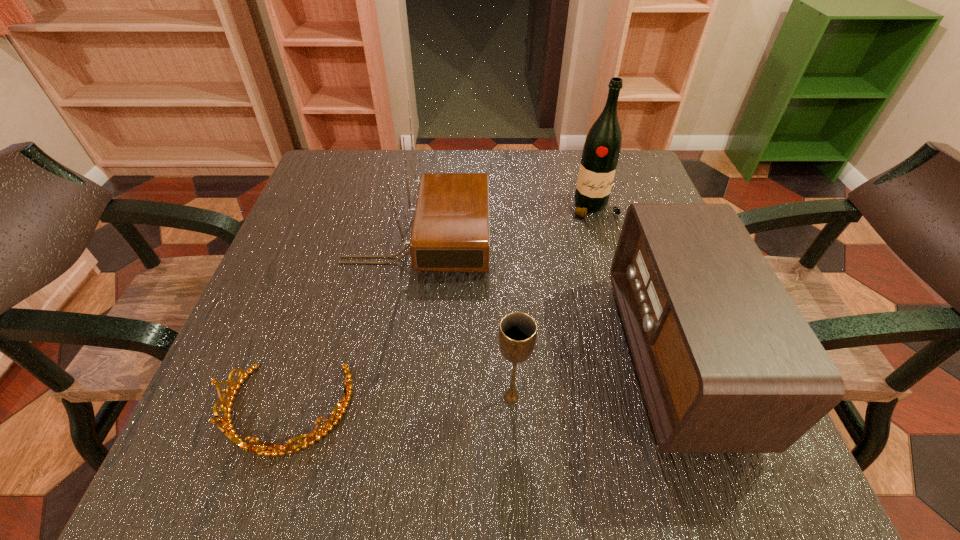
Image resolution: width=960 pixels, height=540 pixels. Find the location of `free region located 0.200m on the front-facing side of the shorter radio receiver`. free region located 0.200m on the front-facing side of the shorter radio receiver is located at coordinates (509, 356).

I want to click on vacant space located 0.070m on the right of the third object from left to right, so click(572, 397).

Identify the location of wine bottle situated at the far edge. (x=601, y=151).

Where is `radio_receiver that is at the far edge`? radio_receiver that is at the far edge is located at coordinates (450, 232).

Locate an element on the screen. Image resolution: width=960 pixels, height=540 pixels. radio receiver that is positioned at the near edge is located at coordinates (727, 363).

Where is `tiara situated at the near edge`? The image size is (960, 540). tiara situated at the near edge is located at coordinates (273, 449).

You are a GUI agent. You are given a task and a screenshot of the screen. Output one action in this format:
    pyautogui.click(x=<x>, y=<y>)
    Task: Click on the radio_receiver located in the left edge section of the desktop
    The height and width of the screenshot is (540, 960).
    Given the screenshot: What is the action you would take?
    pyautogui.click(x=450, y=232)

You are a GUI agent. You are given a task and a screenshot of the screen. Output one action in this format:
    pyautogui.click(x=<x>, y=<y>)
    Task: Click on the tiara present at the left edge
    This screenshot has height=540, width=960.
    Given the screenshot: What is the action you would take?
    pyautogui.click(x=273, y=449)

I want to click on wine bottle that is at the right edge, so click(x=601, y=151).

The height and width of the screenshot is (540, 960). Identify the location of radio receiver that is positioned at the right edge. (727, 363).